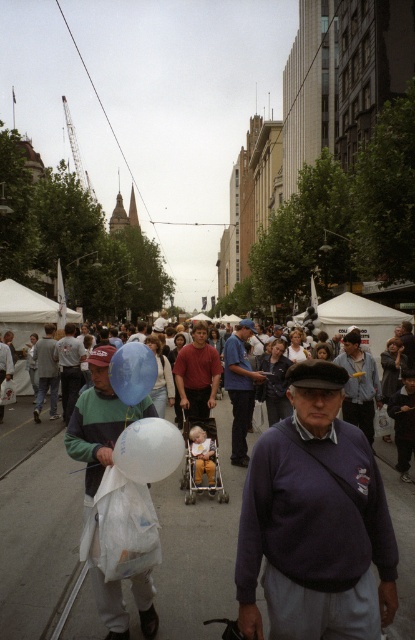
Question: Is white translucent balloon at center closer to camera compared to golden yellow plastic stroller at center?

Choices:
 (A) yes
 (B) no

Answer: (A)

Question: Is translucent plastic bag at center smaller than red cotton shirt at center?

Choices:
 (A) no
 (B) yes

Answer: (A)

Question: Estimate the real-world distances between objects in this image. Which object is closer to the red cotton shirt at center?

Choices:
 (A) translucent blue balloon at center
 (B) white translucent balloon at center

Answer: (A)

Question: Which object appears closest to the camera in this image?

Choices:
 (A) blue denim jeans at center
 (B) purple sweater at center

Answer: (B)

Question: Can you confirm if translucent plastic bag at center is thinner than blue denim jeans at center?

Choices:
 (A) no
 (B) yes

Answer: (A)

Question: Among these objects, which one is nearest to the camera?

Choices:
 (A) golden yellow plastic stroller at center
 (B) red cotton shirt at center

Answer: (A)